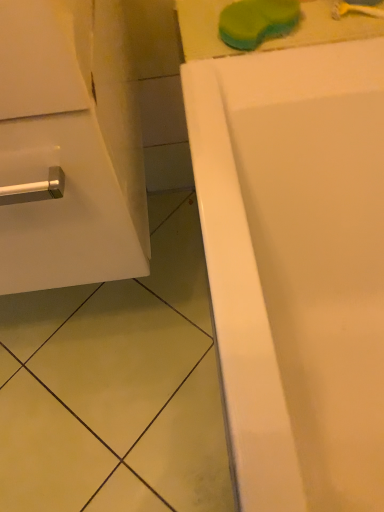
Measure the distance between green sponge at upper center and camera.

They are 26.92 inches apart.

What do you see at coordinates (257, 22) in the screenshot? This screenshot has width=384, height=512. I see `green sponge at upper center` at bounding box center [257, 22].

Find the location of a particular element. The image size is (384, 512). white glossy cabinet at left is located at coordinates click(69, 148).

This screenshot has width=384, height=512. Find the location of `green sponge at upper center`. green sponge at upper center is located at coordinates (257, 22).

Based on the photo, is green sponge at upper center far from yellow plastic toothbrush at upper right?

They are positioned close to each other.

From a real-world perspective, is green sponge at upper center positioned above or below yellow plastic toothbrush at upper right?

green sponge at upper center is situated higher than yellow plastic toothbrush at upper right in the real world.

Is yellow plastic toothbrush at upper right inside green sponge at upper center?

No, yellow plastic toothbrush at upper right is not inside green sponge at upper center.

From the image's perspective, is green sponge at upper center above or below yellow plastic toothbrush at upper right?

From the image's perspective, green sponge at upper center appears below yellow plastic toothbrush at upper right.

Is white glossy cabinet at left at the back of green sponge at upper center?

No, white glossy cabinet at left is not at the back of green sponge at upper center.

How many degrees apart are the facing directions of green sponge at upper center and white glossy cabinet at left?

green sponge at upper center and white glossy cabinet at left are facing 0.411 degrees away from each other.

The height and width of the screenshot is (512, 384). In order to click on soap that appears below the white glossy cabinet at left (from a real-world perspective) in this screenshot , I will do `click(257, 22)`.

From a real-world perspective, which object stands above the other?

white glossy cabinet at left is physically above.

Considering the sizes of objects yellow plastic toothbrush at upper right and white glossy cabinet at left in the image provided, who is bigger, yellow plastic toothbrush at upper right or white glossy cabinet at left?

With larger size is white glossy cabinet at left.

Who is shorter, yellow plastic toothbrush at upper right or white glossy cabinet at left?

Standing shorter between the two is yellow plastic toothbrush at upper right.

Is white glossy cabinet at left located within yellow plastic toothbrush at upper right?

That's incorrect, white glossy cabinet at left is not inside yellow plastic toothbrush at upper right.

How much distance is there between yellow plastic toothbrush at upper right and white glossy cabinet at left?

The distance of yellow plastic toothbrush at upper right from white glossy cabinet at left is 21.02 inches.

From the image's perspective, who appears lower, white glossy cabinet at left or yellow plastic toothbrush at upper right?

white glossy cabinet at left, from the image's perspective.

Is point (123, 261) farther from camera compared to point (378, 11)?

No, it is in front of (378, 11).

Does white glossy cabinet at left appear on the right side of yellow plastic toothbrush at upper right?

No, white glossy cabinet at left is not to the right of yellow plastic toothbrush at upper right.

From a real-world perspective, which object rests below the other?

yellow plastic toothbrush at upper right, from a real-world perspective.

Considering the relative sizes of yellow plastic toothbrush at upper right and green sponge at upper center in the image provided, is yellow plastic toothbrush at upper right shorter than green sponge at upper center?

Yes.

Consider the image. Does yellow plastic toothbrush at upper right have a smaller size compared to green sponge at upper center?

Correct, yellow plastic toothbrush at upper right occupies less space than green sponge at upper center.

Image resolution: width=384 pixels, height=512 pixels. What are the coordinates of `toothbrush behind the green sponge at upper center` in the screenshot? It's located at (355, 9).

Considering their positions, is white glossy cabinet at left located in front of or behind green sponge at upper center?

In the image, white glossy cabinet at left appears in front of green sponge at upper center.

Is white glossy cabinet at left oriented away from green sponge at upper center?

No, white glossy cabinet at left is not facing away from green sponge at upper center.

Looking at the image, does white glossy cabinet at left seem bigger or smaller compared to green sponge at upper center?

Clearly, white glossy cabinet at left is larger in size than green sponge at upper center.

Are white glossy cabinet at left and green sponge at upper center beside each other?

white glossy cabinet at left is not next to green sponge at upper center, and they're not touching.

Where is `toothbrush that is behind the green sponge at upper center`? toothbrush that is behind the green sponge at upper center is located at coordinates (355, 9).

The width and height of the screenshot is (384, 512). I want to click on bathroom cabinet above the green sponge at upper center (from a real-world perspective), so click(69, 148).

Which object lies further to the anchor point yellow plastic toothbrush at upper right, green sponge at upper center or white glossy cabinet at left?

white glossy cabinet at left lies further to yellow plastic toothbrush at upper right than the other object.

Based on their spatial positions, is yellow plastic toothbrush at upper right or green sponge at upper center closer to white glossy cabinet at left?

The object closer to white glossy cabinet at left is green sponge at upper center.

Estimate the real-world distances between objects in this image. Which object is further from yellow plastic toothbrush at upper right, white glossy cabinet at left or green sponge at upper center?

The object further to yellow plastic toothbrush at upper right is white glossy cabinet at left.

From the image, which object appears to be farther from green sponge at upper center, yellow plastic toothbrush at upper right or white glossy cabinet at left?

white glossy cabinet at left is positioned further to the anchor green sponge at upper center.

When comparing their distances from green sponge at upper center, does white glossy cabinet at left or yellow plastic toothbrush at upper right seem closer?

Among the two, yellow plastic toothbrush at upper right is located nearer to green sponge at upper center.

Based on their spatial positions, is green sponge at upper center or yellow plastic toothbrush at upper right closer to white glossy cabinet at left?

green sponge at upper center lies closer to white glossy cabinet at left than the other object.

This screenshot has height=512, width=384. What are the coordinates of `soap situated between white glossy cabinet at left and yellow plastic toothbrush at upper right from left to right` in the screenshot? It's located at (257, 22).